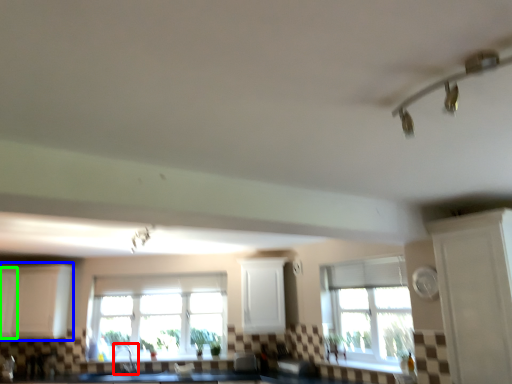
Question: Which object is positioned farthest from faucet (highlighted by a red box)? Select from cabinetry (highlighted by a blue box) and cabinetry (highlighted by a green box).

Choices:
 (A) cabinetry
 (B) cabinetry

Answer: (B)